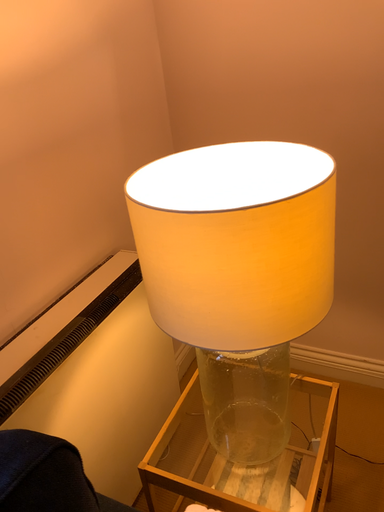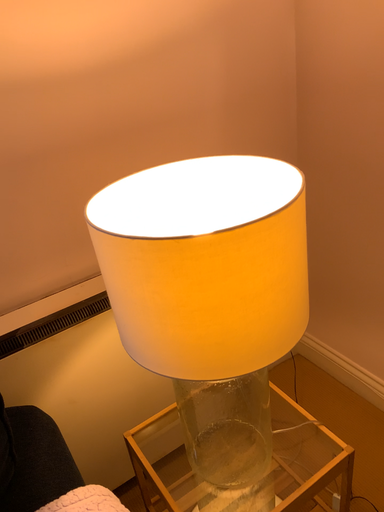
Question: How did the camera likely rotate when shooting the video?

Choices:
 (A) rotated left
 (B) rotated right

Answer: (A)